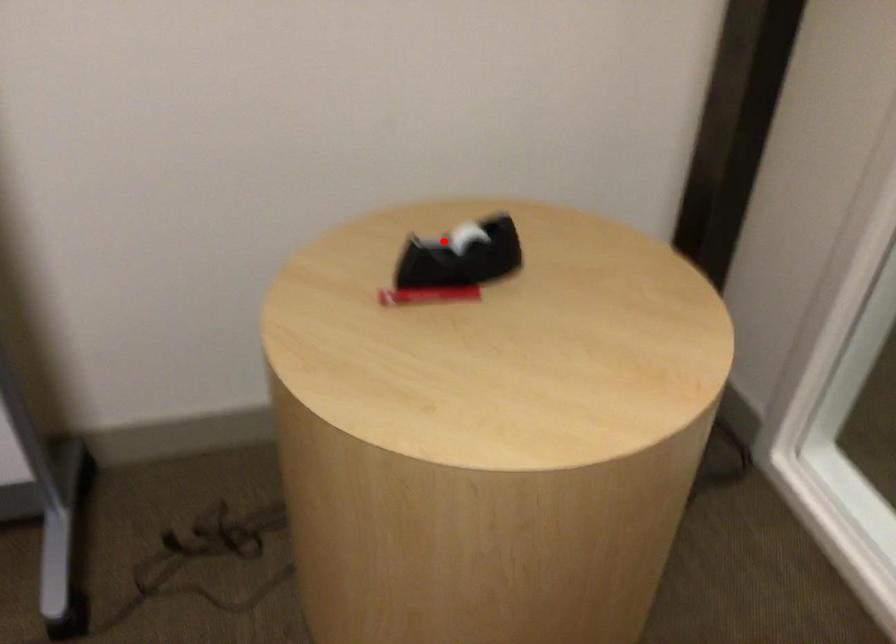
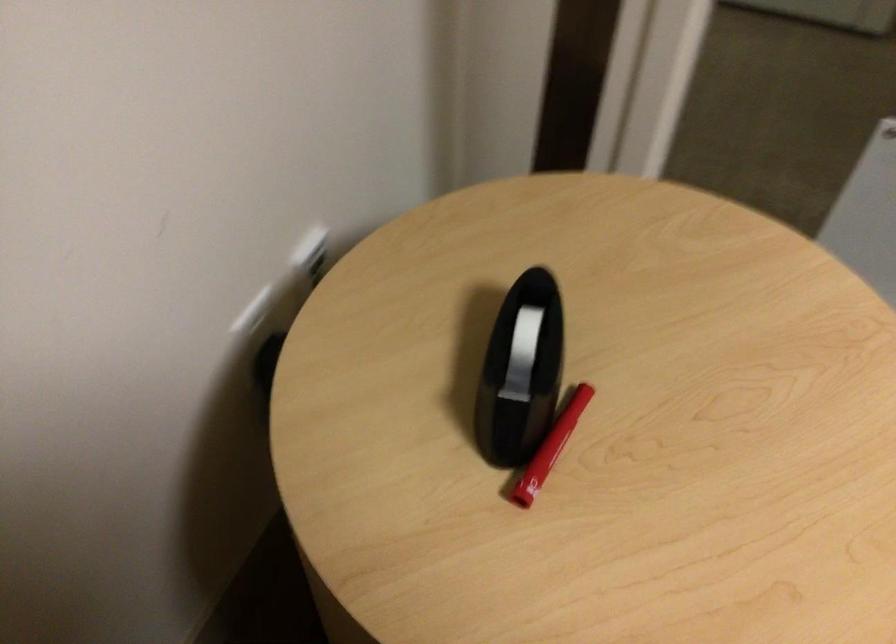
Question: I am providing you with two images of the same scene from different viewpoints. Image1 has a red point marked. In image2, the corresponding 3D location appears at what relative position? Reply with the corresponding letter.

Choices:
 (A) Closer
 (B) Farther

Answer: (A)